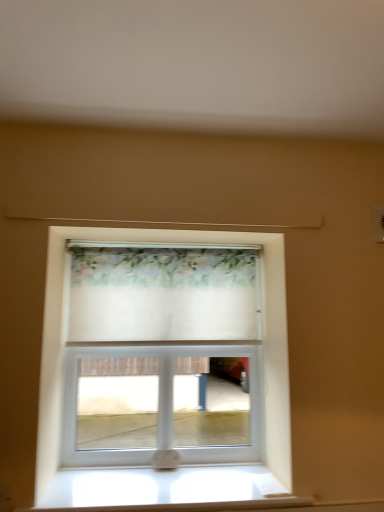
Locate an element on the screen. This screenshot has height=512, width=384. vacant space underneath floral sheer curtain at center (from a real-world perspective) is located at coordinates (175, 473).